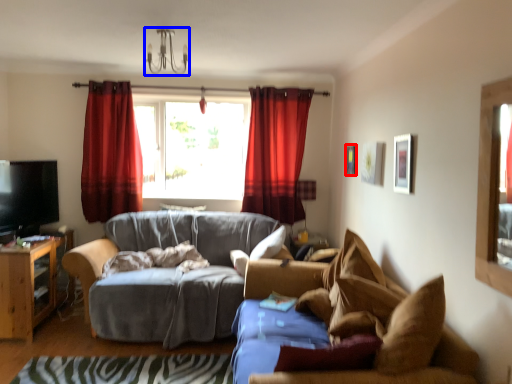
Question: Among these objects, which one is farthest to the camera, picture frame (highlighted by a red box) or light fixture (highlighted by a blue box)?

Choices:
 (A) picture frame
 (B) light fixture

Answer: (A)